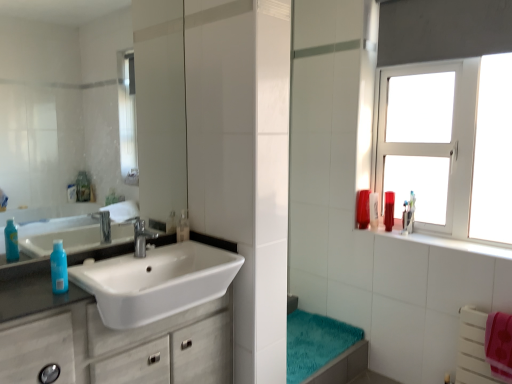
Identify the location of free space in front of silver metallic faucet at center. This screenshot has width=512, height=384. (123, 268).